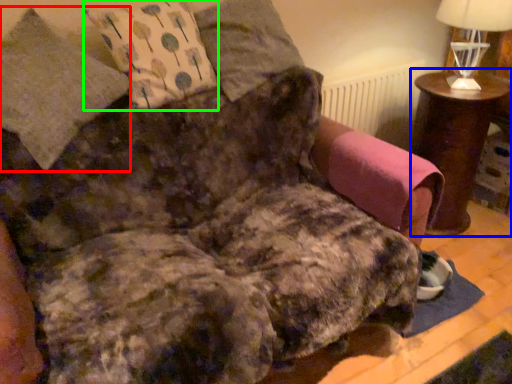
Question: Which object is positioned closest to pillow (highlighted by a red box)? Select from table (highlighted by a blue box) and throw pillow (highlighted by a green box).

Choices:
 (A) table
 (B) throw pillow

Answer: (B)